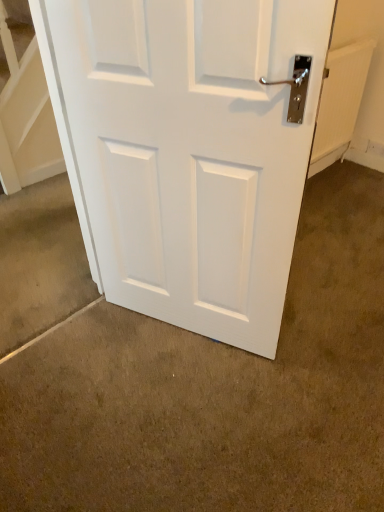
Locate an element on the screen. This screenshot has height=512, width=384. free location in front of white matte door at center is located at coordinates (187, 413).